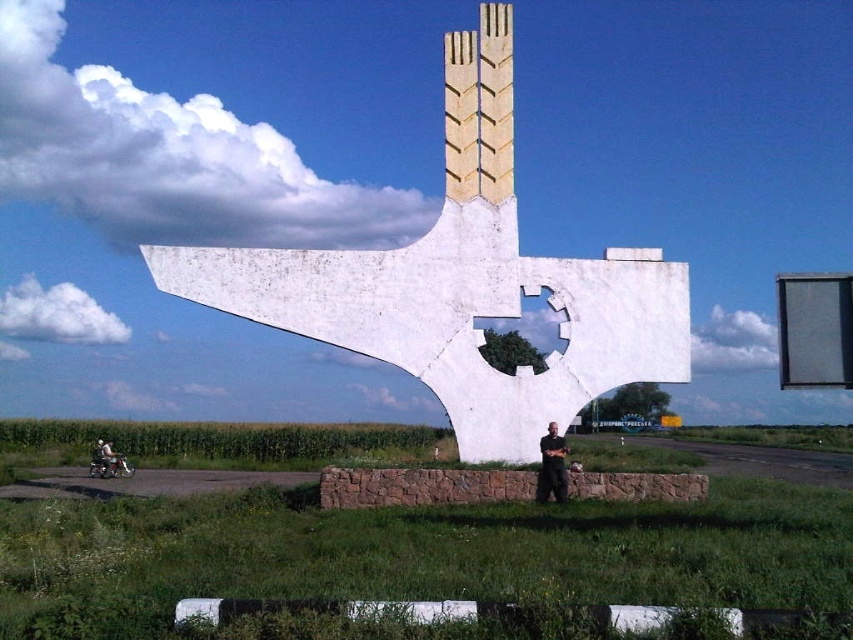
You are a photographer trying to capture the white concrete sculpture at center and the black fabric pants at center in a single frame. Based on their sizes, which object should you focus on to ensure both are visible without cropping?

The white concrete sculpture at center is wider than the black fabric pants at center, so focusing on the sculpture will help ensure both are visible in the frame.

You are standing at the camera position, and you want to take a photo of the white concrete sculpture at center. The camera has a maximum zoom range of 40 meters. Can you capture the entire sculpture in the photo without moving closer?

The white concrete sculpture at center and camera are 45.33 meters apart from each other. Since the camera can only zoom up to 40 meters, you cannot capture the entire sculpture without moving closer.

In the scene shown: You are standing at the point with coordinates (463, 282) in the image. What object are you directly facing?

The point at coordinates (463, 282) corresponds to the white concrete sculpture at center, so you are directly facing the white concrete sculpture at center.